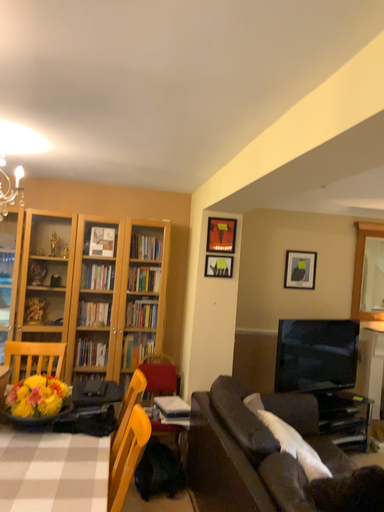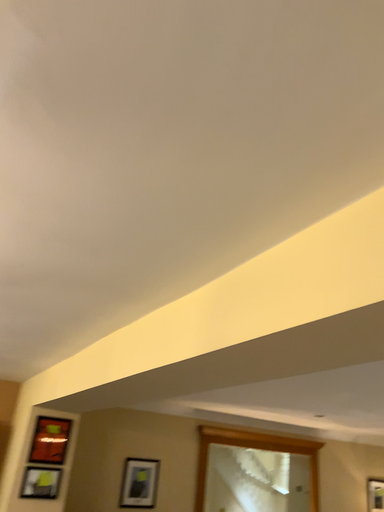
Question: How did the camera likely rotate when shooting the video?

Choices:
 (A) rotated upward
 (B) rotated downward

Answer: (A)